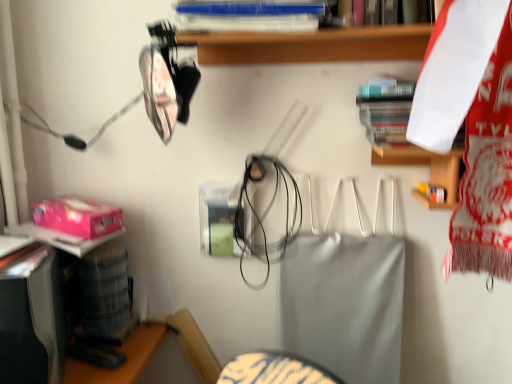
I want to click on blank space situated above pink matte box at lower left (from a real-world perspective), so click(68, 200).